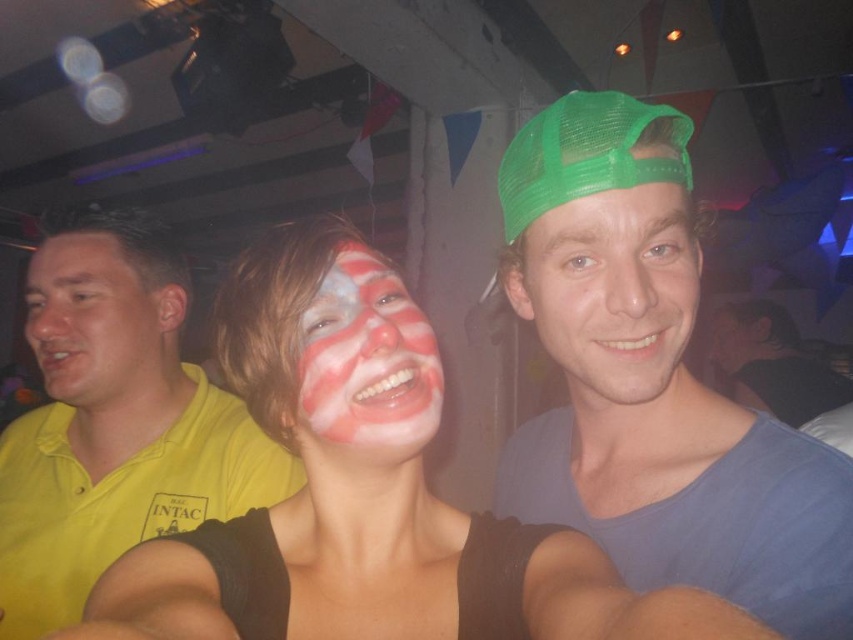
Question: Among these objects, which one is farthest from the camera?

Choices:
 (A) yellow polo shirt at left
 (B) painted face at center
 (C) matte face paint at center

Answer: (A)

Question: Does yellow matte shirt at left appear under matte blue shirt at center?

Choices:
 (A) yes
 (B) no

Answer: (B)

Question: Which is farther from the yellow polo shirt at left?

Choices:
 (A) green mesh cap at center
 (B) green mesh cap at upper right
 (C) matte green cap at upper right
 (D) matte blue shirt at center

Answer: (C)

Question: Does matte face paint at center have a smaller size compared to yellow matte shirt at left?

Choices:
 (A) no
 (B) yes

Answer: (A)

Question: Which object is the farthest from the painted face at center?

Choices:
 (A) green mesh cap at center
 (B) matte face paint at center
 (C) yellow matte shirt at left

Answer: (C)

Question: Is matte face paint at center in front of green mesh cap at center?

Choices:
 (A) yes
 (B) no

Answer: (A)